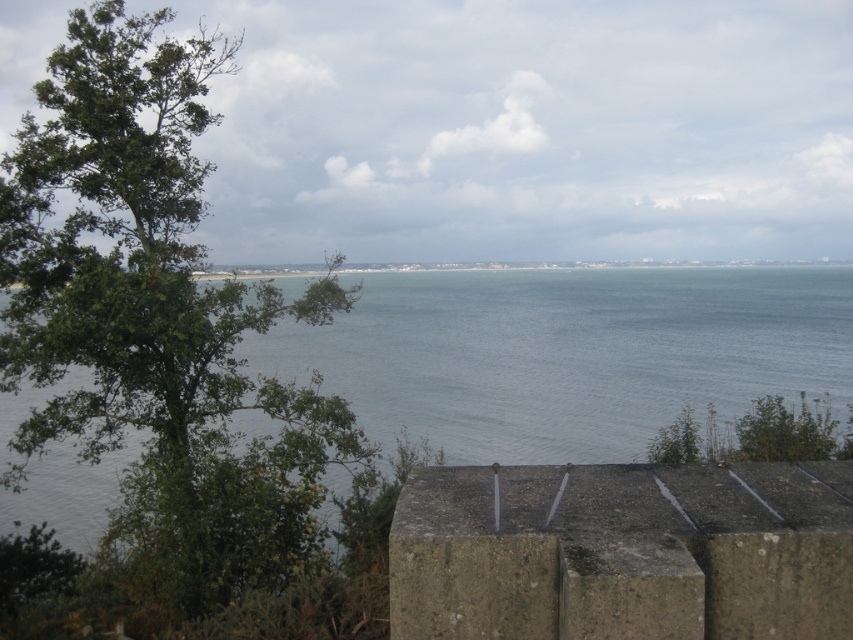
You are standing at the center of the image and want to walk towards the green leafy tree at left. In which direction should you move?

Since the green leafy tree at left is located at point (x=157, y=320), you should move to the left to reach it.